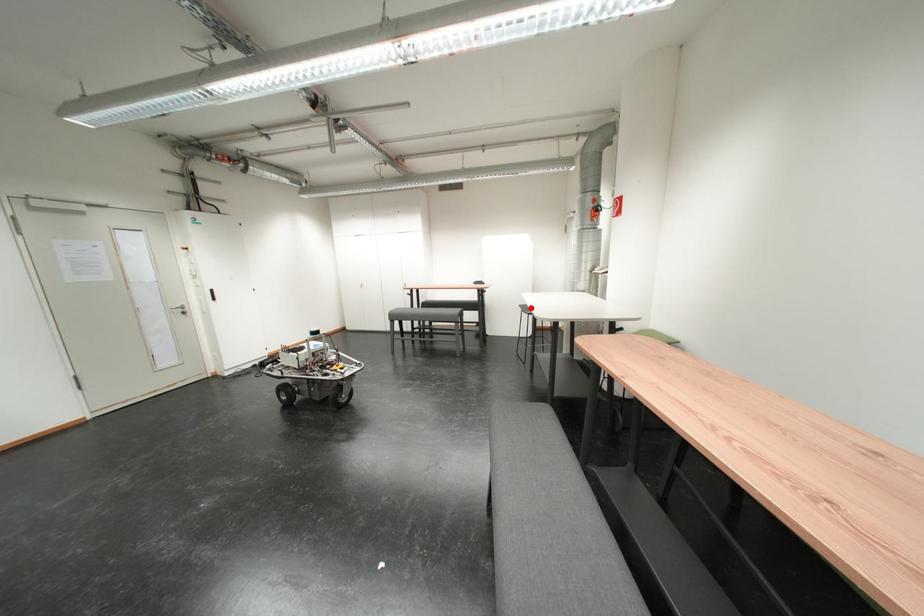
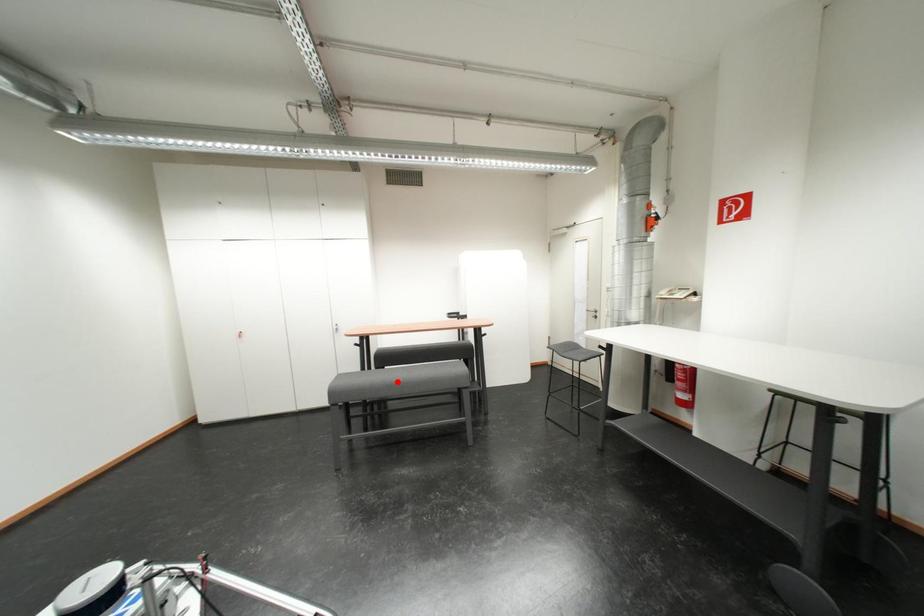
I am providing you with two images of the same scene from different viewpoints. A red point is marked on the first image and another point is marked on the second image. Are the points marked in image1 and image2 representing the same 3D position?

No